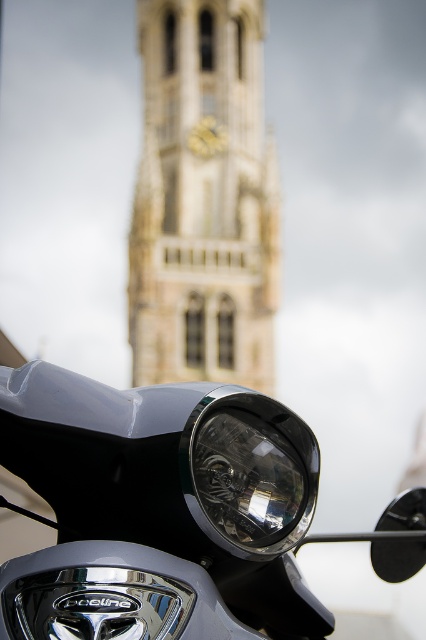
Between stone clock tower at center and clear glass headlight at center, which one has less height?

clear glass headlight at center

This screenshot has height=640, width=426. I want to click on stone clock tower at center, so click(x=204, y=198).

Which is more to the right, satin silver headlight at center or stone clock tower at center?

satin silver headlight at center is more to the right.

Is point (293, 616) behind point (160, 138)?

No, (293, 616) is closer to viewer.

Locate an element on the screen. satin silver headlight at center is located at coordinates (170, 513).

Which is more to the right, satin silver headlight at center or clear glass headlight at center?

satin silver headlight at center

Between point (210, 490) and point (204, 401), which one is positioned in front?

Point (210, 490)

Image resolution: width=426 pixels, height=640 pixels. Identify the location of satin silver headlight at center. (170, 513).